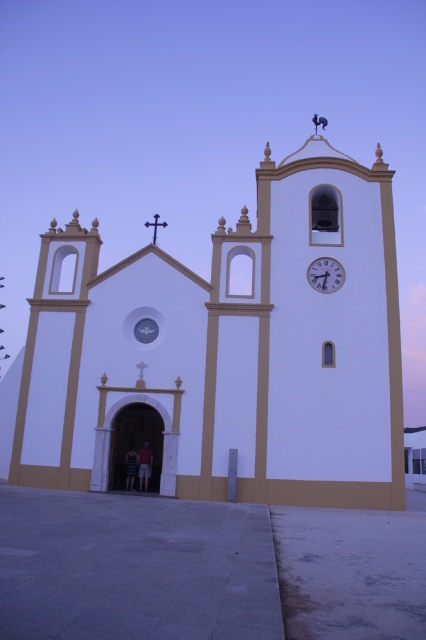
Question: From the image, what is the correct spatial relationship of white smooth church at center in relation to white matte clock at upper right?

Choices:
 (A) below
 (B) above

Answer: (A)

Question: Among these points, which one is nearest to the camera?

Choices:
 (A) (135, 452)
 (B) (147, 481)

Answer: (B)

Question: Which of these objects is positioned closest to the white matte clock at upper right?

Choices:
 (A) metallic cross at center
 (B) white smooth church at center

Answer: (B)

Question: From the image, what is the correct spatial relationship of dark gray fabric pants at lower center in relation to metallic cross at center?

Choices:
 (A) right
 (B) left

Answer: (B)

Question: Based on their relative distances, which object is nearer to the dark gray fabric shirt at center?

Choices:
 (A) metallic cross at center
 (B) white matte clock at upper right
 (C) dark gray fabric pants at lower center

Answer: (C)

Question: Considering the relative positions of dark gray fabric shirt at center and metallic cross at center in the image provided, where is dark gray fabric shirt at center located with respect to metallic cross at center?

Choices:
 (A) above
 (B) below

Answer: (B)